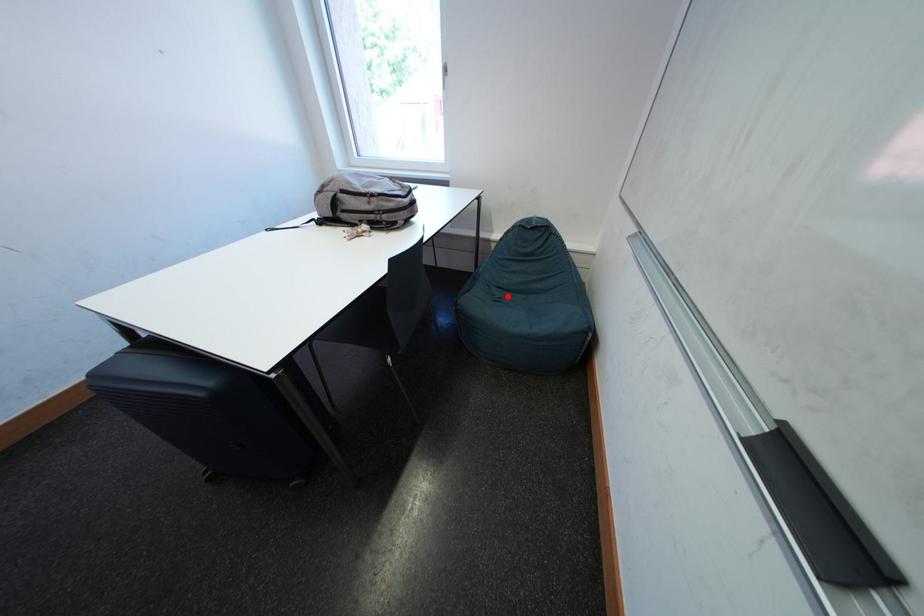
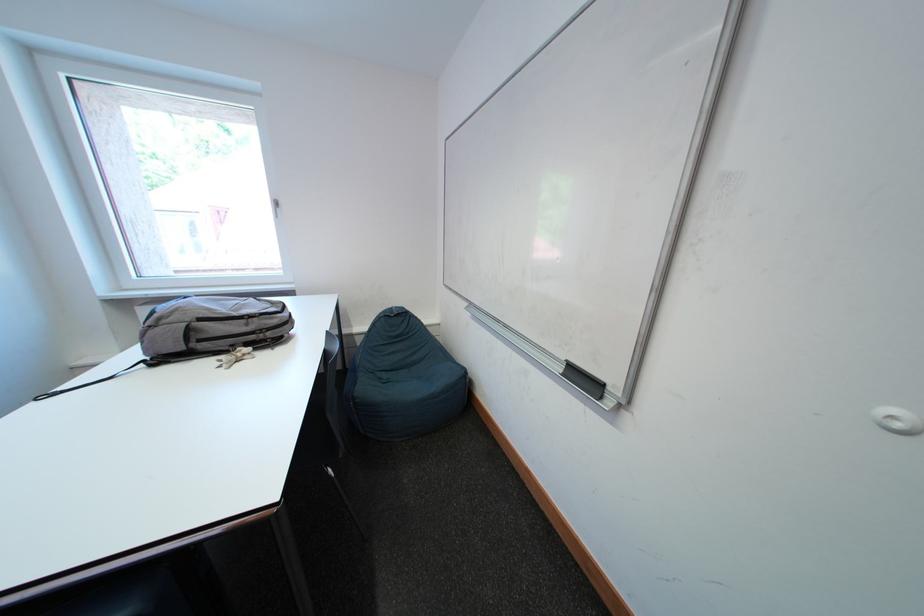
Question: I am providing you with two images of the same scene from different viewpoints. Image1 has a red point marked. In image2, the corresponding 3D location appears at what relative position? Reply with the corresponding letter.

Choices:
 (A) Closer
 (B) Farther

Answer: (B)